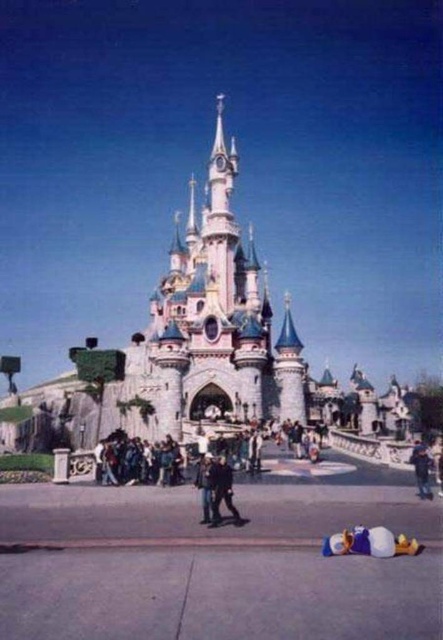
You are standing at the entrance of the theme park and see the castle in the distance. There is a point marked at coordinates (205, 355). Which object in the scene does this point belong to?

The point at coordinates (205, 355) is on the light blue stone castle at center.

Consider the image. You are standing at the entrance of the theme park and want to reach the light blue stone castle at center. If you walk at a speed of 1.5 meters per second, how many seconds will it take you to reach the castle?

The light blue stone castle at center is 89.33 meters away from the viewer. Walking at 1.5 meters per second, it would take approximately 59.55 seconds to reach it.